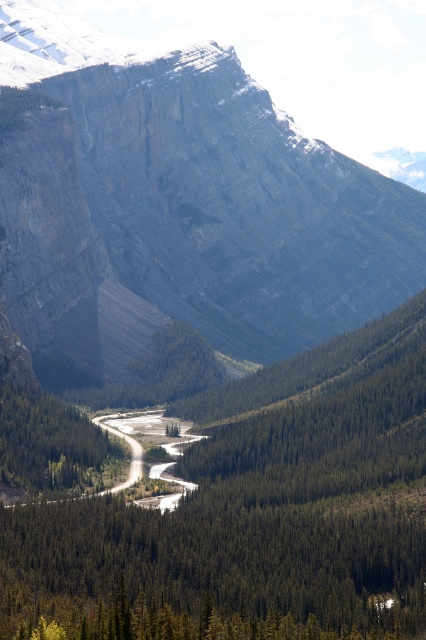
Is the position of gray rock cliff at upper center more distant than that of green matte tree at center?

Yes, it is.

Between point (164, 58) and point (60, 576), which one is positioned in front?

Point (60, 576) is in front.

The height and width of the screenshot is (640, 426). I want to click on gray rock cliff at upper center, so click(x=176, y=205).

Find the location of a particular element. The height and width of the screenshot is (640, 426). gray rock cliff at upper center is located at coordinates (176, 205).

Does point (268, 497) come closer to viewer compared to point (158, 506)?

Yes, it is.

Is green matte tree at center wider than gravel road at center?

Indeed, green matte tree at center has a greater width compared to gravel road at center.

Who is more forward, [118,500] or [163,508]?

Point [118,500] is more forward.

Find the location of a particular element. This screenshot has height=640, width=426. green matte tree at center is located at coordinates (261, 500).

Describe the element at coordinates (261, 500) in the screenshot. I see `green matte tree at center` at that location.

Is point (399, 397) more distant than point (48, 467)?

Yes, point (399, 397) is farther from viewer.

You are a GUI agent. You are given a task and a screenshot of the screen. Output one action in this format:
    pyautogui.click(x=<x>, y=<y>)
    Task: Click on the green matte tree at center
    
    Given the screenshot: What is the action you would take?
    pyautogui.click(x=261, y=500)